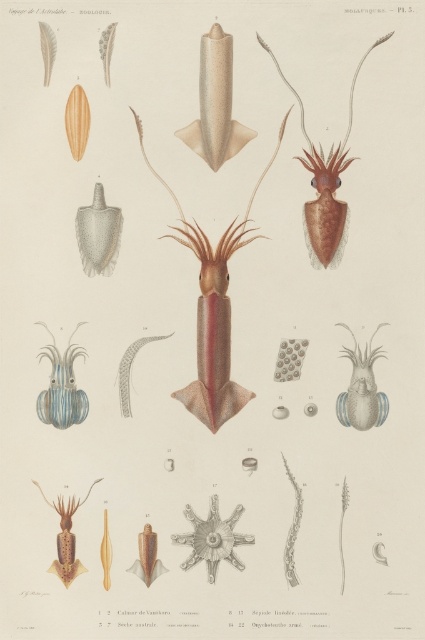
Is blue striped squid at lower left further to the viewer compared to translucent brown squid at center?

Yes, it is behind translucent brown squid at center.

Find the location of a particular element. This screenshot has height=640, width=425. blue striped squid at lower left is located at coordinates (62, 387).

Can you confirm if matte brown squid at upper right is shorter than translucent blue squid at center?

No, matte brown squid at upper right is not shorter than translucent blue squid at center.

The height and width of the screenshot is (640, 425). What do you see at coordinates (325, 184) in the screenshot?
I see `matte brown squid at upper right` at bounding box center [325, 184].

Image resolution: width=425 pixels, height=640 pixels. In order to click on matte brown squid at upper right in this screenshot , I will do `click(325, 184)`.

Does matte brown squid at upper right have a lesser width compared to translucent brown squid at center?

Result: No, matte brown squid at upper right is not thinner than translucent brown squid at center.

Between point (342, 250) and point (73, 557), which one is positioned behind?

Positioned behind is point (342, 250).

The image size is (425, 640). In order to click on matte brown squid at upper right in this screenshot , I will do `click(325, 184)`.